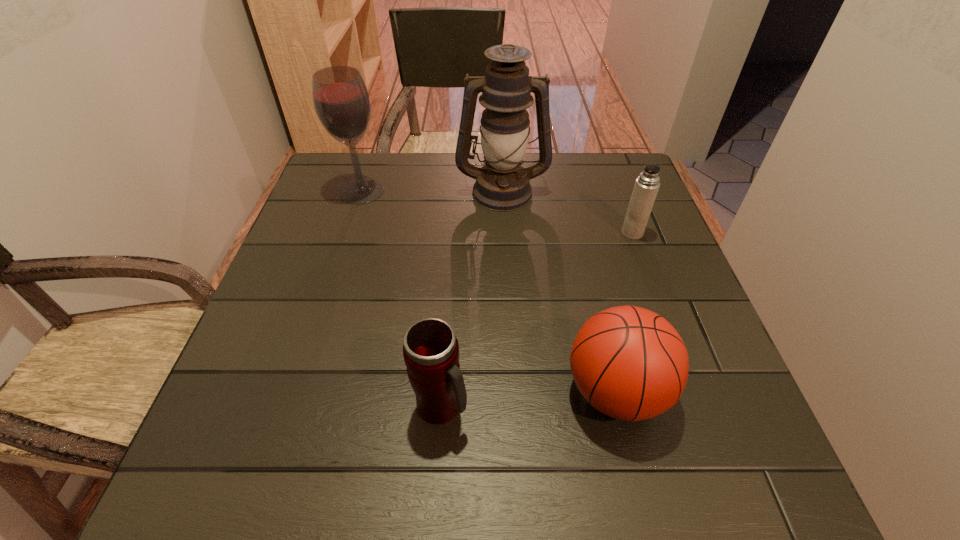
Where is `unoccupied area between the oil lamp and the basketball`? Image resolution: width=960 pixels, height=540 pixels. unoccupied area between the oil lamp and the basketball is located at coordinates (559, 291).

Identify the location of free space between the alcohol and the left thermos bottle. The width and height of the screenshot is (960, 540). (401, 299).

Identify the location of vacant point located between the rightmost object and the left thermos bottle. (537, 320).

Identify the location of blank region between the tallest object and the leftmost object. Image resolution: width=960 pixels, height=540 pixels. tap(432, 191).

Locate which object is the third closest to the left thermos bottle. Please provide its 2D coordinates. Your answer should be formatted as a tuple, i.e. [(x, y)], where the tuple contains the x and y coordinates of a point satisfying the conditions above.

[(646, 187)]

Locate which object is the closest to the farther thermos bottle. Please provide its 2D coordinates. Your answer should be formatted as a tuple, i.e. [(x, y)], where the tuple contains the x and y coordinates of a point satisfying the conditions above.

[(502, 184)]

Find the location of `vacant area in the image that satisfies the following two spatial constraints: 1. on the front side of the leftmost object; 2. on the left side of the rightmost object`. vacant area in the image that satisfies the following two spatial constraints: 1. on the front side of the leftmost object; 2. on the left side of the rightmost object is located at coordinates (348, 233).

Find the location of `vacant region that satisfies the following two spatial constraints: 1. on the front side of the tallest object; 2. on the side with the handle of the left thermos bottle`. vacant region that satisfies the following two spatial constraints: 1. on the front side of the tallest object; 2. on the side with the handle of the left thermos bottle is located at coordinates (515, 407).

The height and width of the screenshot is (540, 960). Find the location of `blank space that satisfies the following two spatial constraints: 1. on the front side of the farther thermos bottle; 2. on the right side of the fourth shortest object`. blank space that satisfies the following two spatial constraints: 1. on the front side of the farther thermos bottle; 2. on the right side of the fourth shortest object is located at coordinates (348, 233).

Identify the location of vacant space that satisfies the following two spatial constraints: 1. on the front side of the rightmost object; 2. on the left side of the oil lamp. (505, 233).